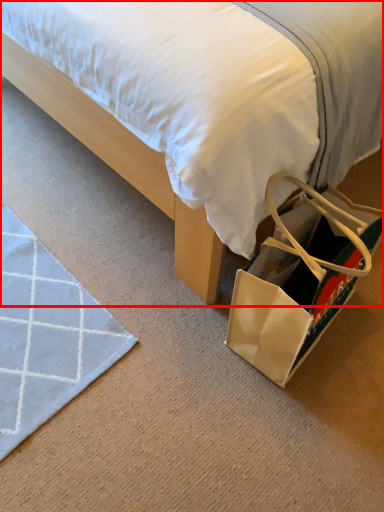
Question: From the image's perspective, considering the relative positions of bed (annotated by the red box) and shoulder bag in the image provided, where is bed (annotated by the red box) located with respect to the staircase?

Choices:
 (A) above
 (B) below

Answer: (A)